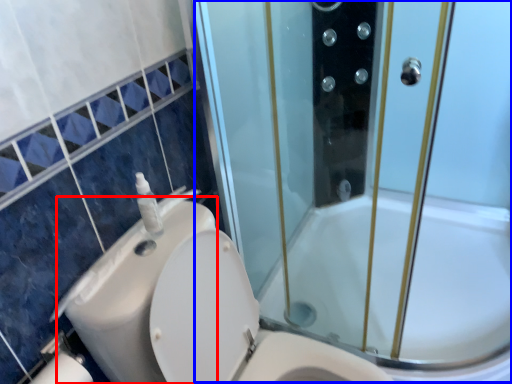
Question: Which point is closer to the camera, sink (highlighted by a red box) or screen door (highlighted by a blue box)?

Choices:
 (A) sink
 (B) screen door

Answer: (B)